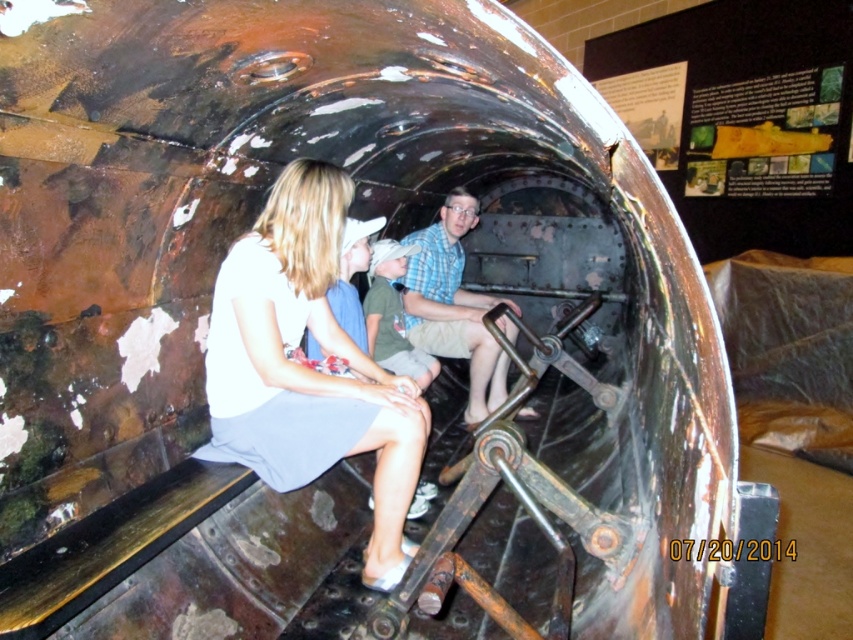
Question: Which of the following is the closest to the observer?

Choices:
 (A) white fabric dress at center
 (B) checkered fabric shirt at center

Answer: (A)

Question: Is white fabric dress at center positioned before checkered fabric shirt at center?

Choices:
 (A) no
 (B) yes

Answer: (B)

Question: Can you confirm if white fabric dress at center is thinner than checkered fabric shirt at center?

Choices:
 (A) yes
 (B) no

Answer: (B)

Question: Does white fabric dress at center have a larger size compared to checkered fabric shirt at center?

Choices:
 (A) yes
 (B) no

Answer: (B)